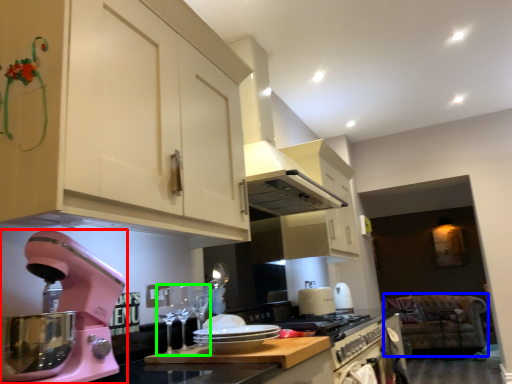
Question: Estimate the real-world distances between objects in this image. Which object is closer to home appliance (highlighted by a red box), sit (highlighted by a blue box) or wine glass (highlighted by a green box)?

Choices:
 (A) sit
 (B) wine glass

Answer: (B)